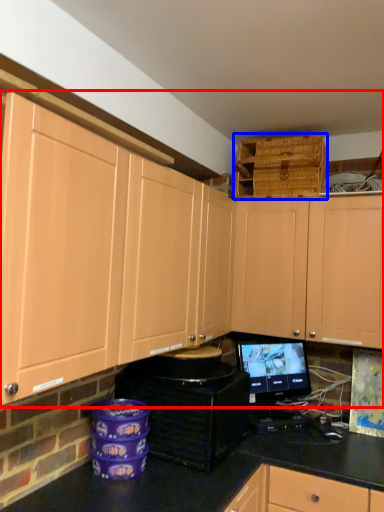
Question: Which object is closer to the camera taking this photo, cabinetry (highlighted by a red box) or basket (highlighted by a blue box)?

Choices:
 (A) cabinetry
 (B) basket

Answer: (A)